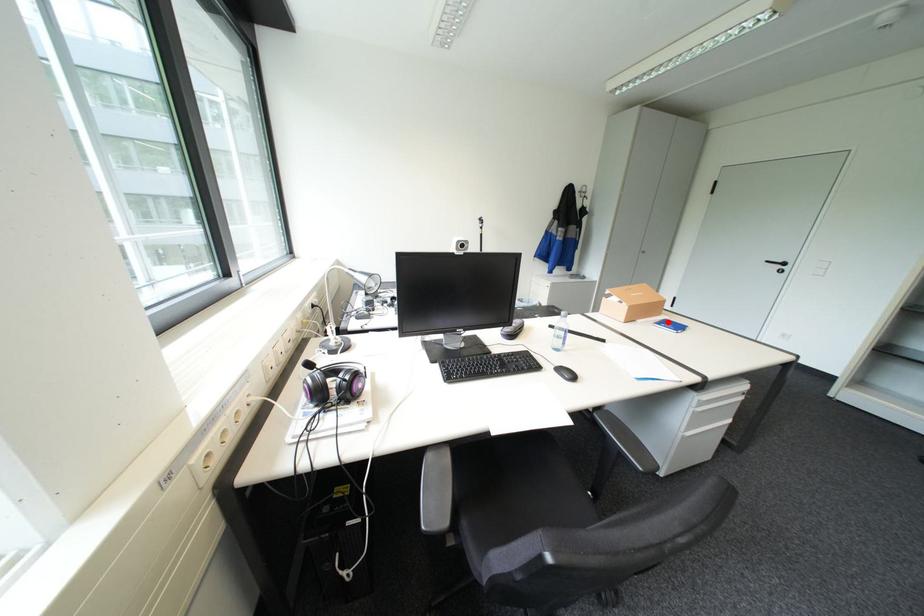
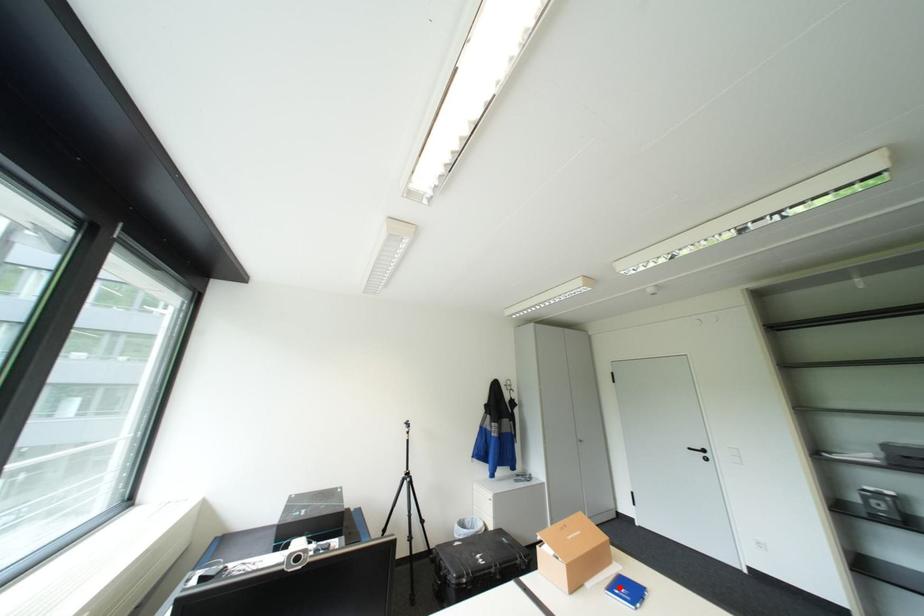
I am providing you with two images of the same scene from different viewpoints. A red point is marked on the first image and another point is marked on the second image. Is the marked point in image1 the same physical position as the marked point in image2?

Yes